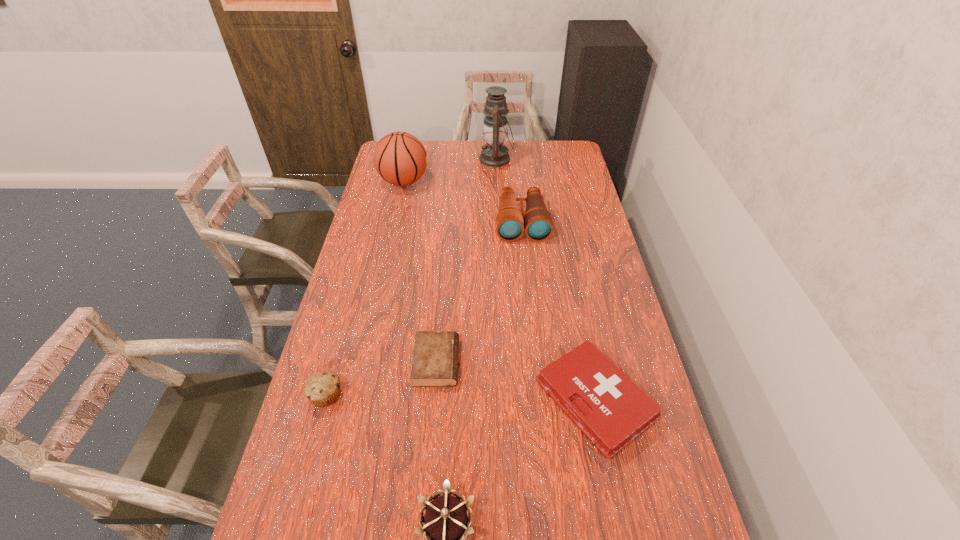
I want to click on free space between the oil lamp and the sixth shortest object, so click(x=450, y=171).

Where is `empty space between the shortest object and the muffin`? This screenshot has height=540, width=960. empty space between the shortest object and the muffin is located at coordinates (381, 379).

The height and width of the screenshot is (540, 960). I want to click on free space between the basketball and the tallest object, so click(x=450, y=171).

I want to click on vacant space that's between the shortest object and the fifth shortest object, so pyautogui.click(x=479, y=293).

Where is `empty space between the shortest object and the muffin`? The image size is (960, 540). empty space between the shortest object and the muffin is located at coordinates (381, 379).

The height and width of the screenshot is (540, 960). Find the location of `unoccupied position between the diary and the oil lamp`. unoccupied position between the diary and the oil lamp is located at coordinates (467, 261).

Image resolution: width=960 pixels, height=540 pixels. Identify the location of object identified as the sixth closest to the shortest object. (493, 154).

This screenshot has width=960, height=540. I want to click on object identified as the fifth closest to the shortest object, so click(x=400, y=158).

Identify the location of vacant region that satisfies the following two spatial constraints: 1. on the spine side of the shortest object; 2. on the right side of the sixth tallest object. (434, 400).

Image resolution: width=960 pixels, height=540 pixels. Identify the location of free spot that satisfies the following two spatial constraints: 1. on the side where the inflation valve is located; 2. on the right side of the first-aid kit. (356, 400).